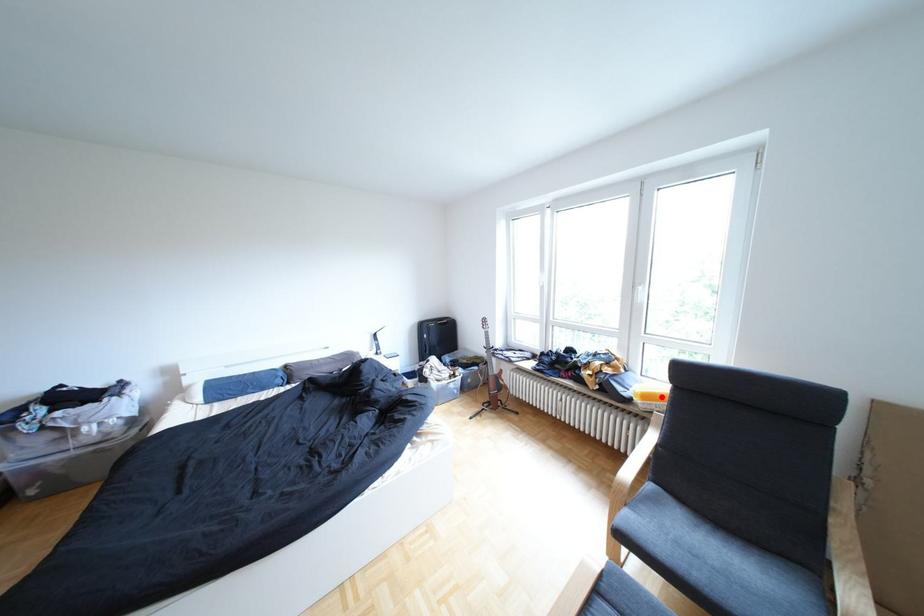
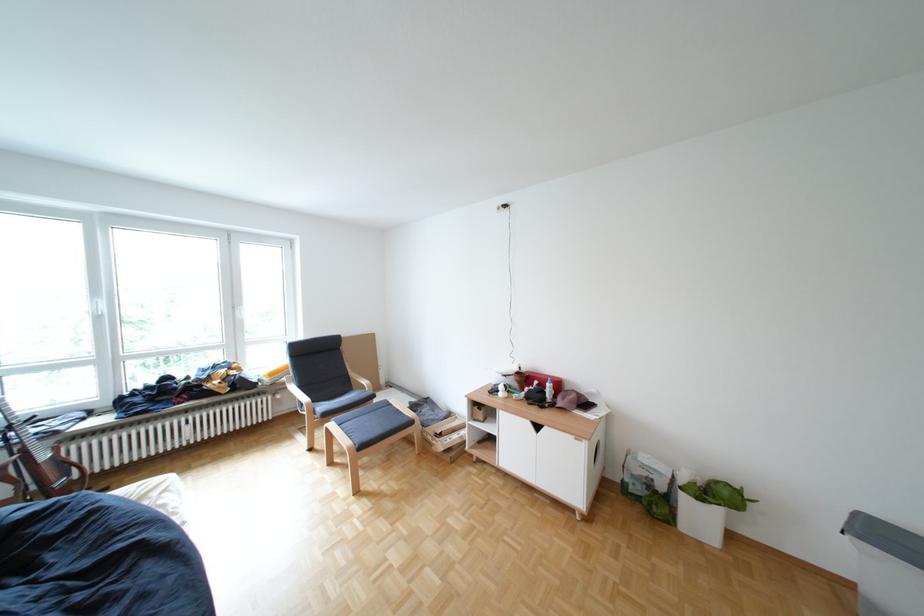
Question: I am providing you with two images of the same scene from different viewpoints. Image1 has a red point marked. In image2, the corresponding 3D location appears at what relative position? Reply with the corresponding letter.

Choices:
 (A) Closer
 (B) Farther

Answer: (B)